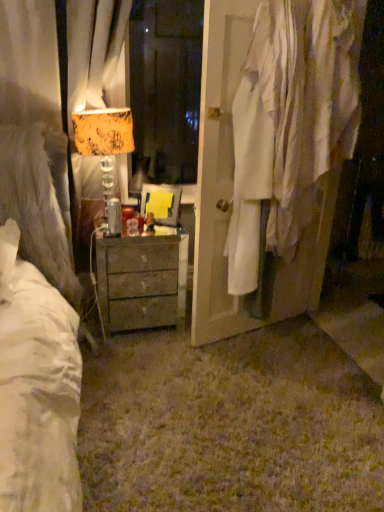
The image size is (384, 512). In order to click on free point below rustic wood chest of drawers at center (from a real-world perspective) in this screenshot , I will do `click(140, 332)`.